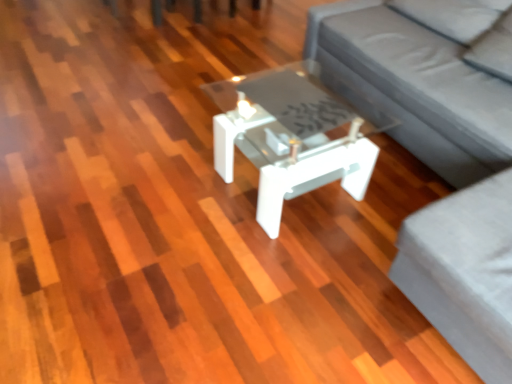
Question: Does gray fabric couch at center lie in front of gray fabric couch at center?

Choices:
 (A) yes
 (B) no

Answer: (B)

Question: From a real-world perspective, is gray fabric couch at center on gray fabric couch at center?

Choices:
 (A) no
 (B) yes

Answer: (A)

Question: Is gray fabric couch at center to the left of gray fabric couch at center from the viewer's perspective?

Choices:
 (A) yes
 (B) no

Answer: (B)

Question: Is gray fabric couch at center thinner than gray fabric couch at center?

Choices:
 (A) yes
 (B) no

Answer: (A)

Question: Is gray fabric couch at center facing towards gray fabric couch at center?

Choices:
 (A) yes
 (B) no

Answer: (A)

Question: From the image's perspective, is white glossy coffee table at center located above or below gray fabric couch at center?

Choices:
 (A) above
 (B) below

Answer: (B)

Question: Looking at their shapes, would you say white glossy coffee table at center is wider or thinner than gray fabric couch at center?

Choices:
 (A) thin
 (B) wide

Answer: (A)

Question: Is point (317, 172) positioned closer to the camera than point (486, 314)?

Choices:
 (A) farther
 (B) closer

Answer: (A)

Question: Relative to gray fabric couch at center, is white glossy coffee table at center in front or behind?

Choices:
 (A) behind
 (B) front

Answer: (A)

Question: Considering the positions of point (264, 157) and point (412, 36), is point (264, 157) closer or farther from the camera than point (412, 36)?

Choices:
 (A) closer
 (B) farther

Answer: (A)

Question: From the image's perspective, is white glossy coffee table at center positioned above or below gray fabric couch at center?

Choices:
 (A) above
 (B) below

Answer: (B)

Question: Relative to gray fabric couch at center, is white glossy coffee table at center in front or behind?

Choices:
 (A) behind
 (B) front

Answer: (A)

Question: Would you say white glossy coffee table at center is to the left or to the right of gray fabric couch at center in the picture?

Choices:
 (A) left
 (B) right

Answer: (A)

Question: Based on their sizes in the image, would you say gray fabric couch at center is bigger or smaller than gray fabric couch at center?

Choices:
 (A) small
 (B) big

Answer: (B)

Question: Is gray fabric couch at center spatially inside gray fabric couch at center, or outside of it?

Choices:
 (A) inside
 (B) outside

Answer: (A)